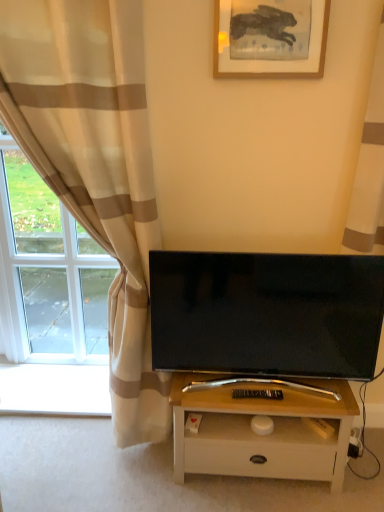
Question: From the image's perspective, is white wood table at center under beige striped curtain at left, which is counted as the first curtain, starting from the left?

Choices:
 (A) yes
 (B) no

Answer: (A)

Question: From a real-world perspective, is white wood table at center on top of beige striped curtain at left, which is counted as the first curtain, starting from the left?

Choices:
 (A) yes
 (B) no

Answer: (B)

Question: Considering the relative positions of white wood table at center and beige striped curtain at left, which is counted as the first curtain, starting from the left, in the image provided, is white wood table at center behind beige striped curtain at left, which is counted as the first curtain, starting from the left,?

Choices:
 (A) yes
 (B) no

Answer: (A)

Question: Is white wood table at center with beige striped curtain at left, acting as the 2th curtain starting from the right?

Choices:
 (A) no
 (B) yes

Answer: (A)

Question: Is white wood table at center outside of beige striped curtain at left, acting as the 2th curtain starting from the right?

Choices:
 (A) yes
 (B) no

Answer: (A)

Question: Would you say white wood table at center contains beige striped curtain at left, which is counted as the first curtain, starting from the left?

Choices:
 (A) no
 (B) yes

Answer: (A)

Question: Can you confirm if wooden picture frame at upper center is wider than beige striped curtain at left, which is counted as the first curtain, starting from the left?

Choices:
 (A) yes
 (B) no

Answer: (B)

Question: Is wooden picture frame at upper center closer to camera compared to beige striped curtain at left, which is counted as the first curtain, starting from the left?

Choices:
 (A) no
 (B) yes

Answer: (A)

Question: Can you confirm if wooden picture frame at upper center is positioned to the right of beige striped curtain at left, acting as the 2th curtain starting from the right?

Choices:
 (A) yes
 (B) no

Answer: (A)

Question: From a real-world perspective, is wooden picture frame at upper center over beige striped curtain at left, which is counted as the first curtain, starting from the left?

Choices:
 (A) yes
 (B) no

Answer: (A)

Question: From the image's perspective, is wooden picture frame at upper center beneath beige striped curtain at left, which is counted as the first curtain, starting from the left?

Choices:
 (A) no
 (B) yes

Answer: (A)

Question: Is wooden picture frame at upper center completely or partially outside of beige striped curtain at left, acting as the 2th curtain starting from the right?

Choices:
 (A) yes
 (B) no

Answer: (A)

Question: From the image's perspective, is beige striped curtain at left, acting as the 2th curtain starting from the right, on top of black plastic remote control at center?

Choices:
 (A) no
 (B) yes

Answer: (B)